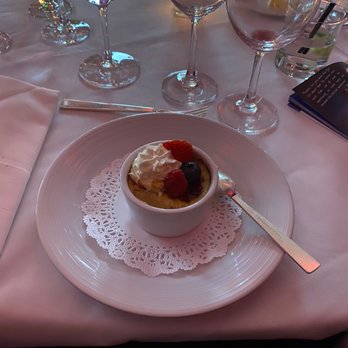
At what (x,y) coordinates should I click in order to perform the action: click on glass. Please return your answer as a coordinate pair (x, y). This screenshot has height=348, width=348. Looking at the image, I should click on (259, 14), (197, 12), (98, 3), (53, 8), (35, 10), (2, 41), (317, 46), (180, 12).